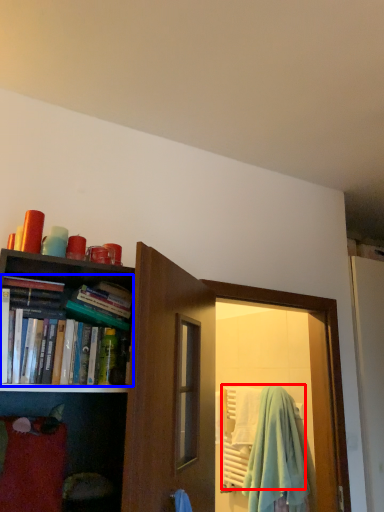
Question: Which object is closer to the camera taking this photo, beach towel (highlighted by a red box) or book (highlighted by a blue box)?

Choices:
 (A) beach towel
 (B) book

Answer: (B)